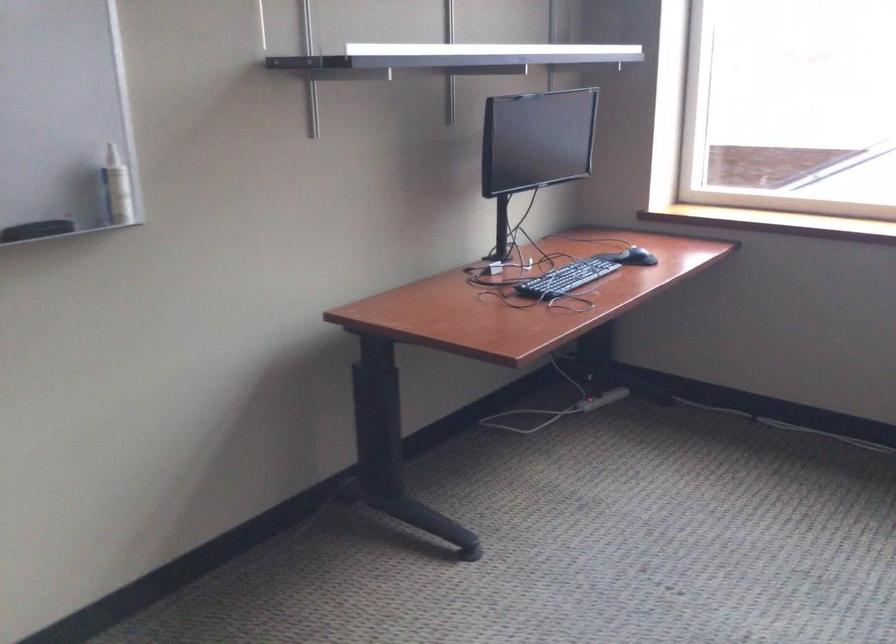
Where is `black whiteboard eraser`? The height and width of the screenshot is (644, 896). black whiteboard eraser is located at coordinates (36, 230).